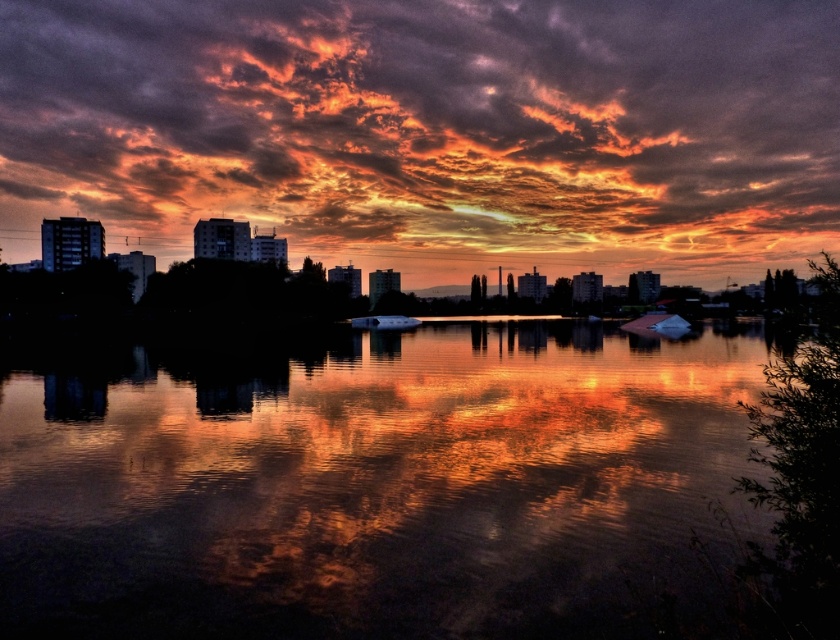
Locate an element on the screen. This screenshot has height=640, width=840. orange textured clouds at upper center is located at coordinates (431, 129).

Where is `orange textured clouds at upper center`? The width and height of the screenshot is (840, 640). orange textured clouds at upper center is located at coordinates (431, 129).

Image resolution: width=840 pixels, height=640 pixels. I want to click on orange textured clouds at upper center, so click(431, 129).

Between orange textured clouds at upper center and reflective glass water at center, which one appears on the left side from the viewer's perspective?

From the viewer's perspective, reflective glass water at center appears more on the left side.

Is point (441, 166) positioned behind point (318, 561)?

Yes, point (441, 166) is farther from viewer.

Identify the location of orange textured clouds at upper center. The height and width of the screenshot is (640, 840). (431, 129).

Does point (694, 522) come in front of point (366, 321)?

Yes, it is.

Consider the image. Is reflective glass water at center to the right of metallic silver boat at center from the viewer's perspective?

Indeed, reflective glass water at center is positioned on the right side of metallic silver boat at center.

At what (x,y) coordinates should I click in order to perform the action: click on reflective glass water at center. Please return your answer as a coordinate pair (x, y). Looking at the image, I should click on (368, 483).

You are a GUI agent. You are given a task and a screenshot of the screen. Output one action in this format:
    pyautogui.click(x=<x>, y=<y>)
    Task: Click on the reflective glass water at center
    This screenshot has width=840, height=640.
    Given the screenshot: What is the action you would take?
    pyautogui.click(x=368, y=483)